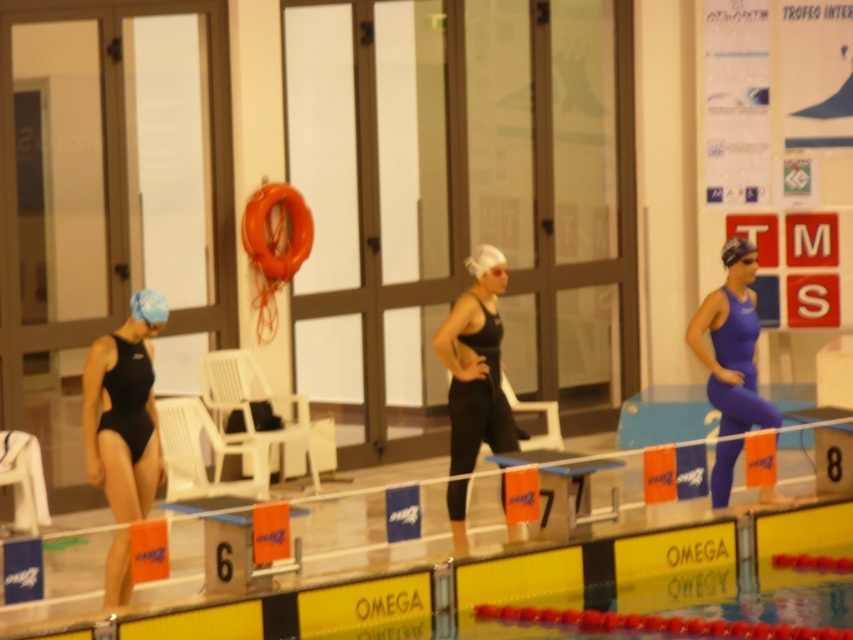
Question: Which object is positioned farthest from the white matte swim cap at center?

Choices:
 (A) blue matte swim cap at upper left
 (B) black matte swimsuit at left

Answer: (B)

Question: Is black matte swimsuit at center bigger than blue matte swim cap at center?

Choices:
 (A) yes
 (B) no

Answer: (A)

Question: From the image, what is the correct spatial relationship of black matte swimsuit at center in relation to blue matte swim cap at upper left?

Choices:
 (A) right
 (B) left

Answer: (A)

Question: Is black matte swimsuit at center in front of blue matte swim cap at center?

Choices:
 (A) no
 (B) yes

Answer: (B)

Question: Estimate the real-world distances between objects in this image. Which object is closer to the white matte swim cap at center?

Choices:
 (A) blue matte swim cap at upper left
 (B) blue matte swim cap at center

Answer: (B)

Question: Which point is closer to the camera?

Choices:
 (A) white matte swim cap at center
 (B) blue matte swimsuit at right

Answer: (A)